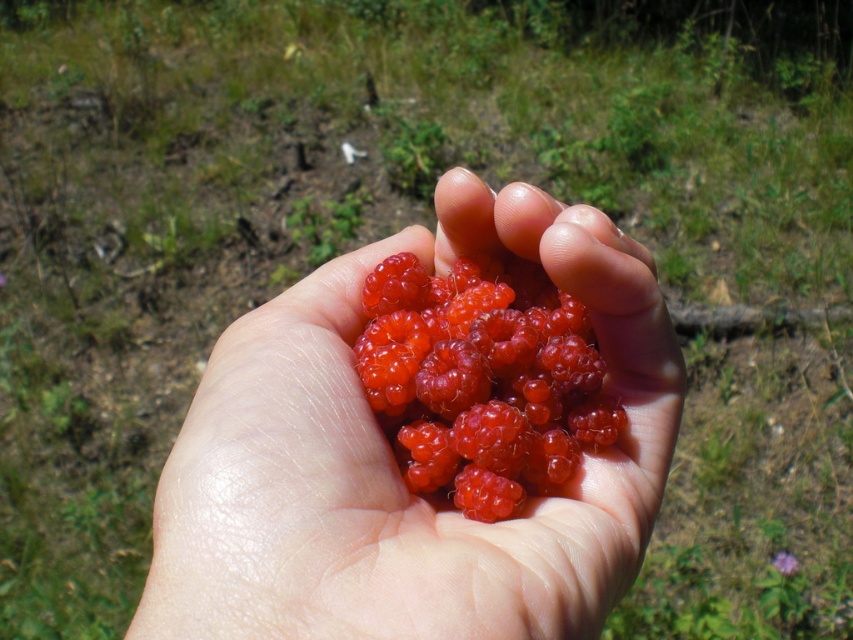
Question: Which object is farther from the camera taking this photo?

Choices:
 (A) glossy red raspberries at center
 (B) shiny red berries at center

Answer: (B)

Question: Can you confirm if glossy red raspberries at center is positioned below shiny red berries at center?

Choices:
 (A) yes
 (B) no

Answer: (A)

Question: Can you confirm if glossy red raspberries at center is thinner than shiny red berries at center?

Choices:
 (A) no
 (B) yes

Answer: (A)

Question: Which of the following is the closest to the observer?

Choices:
 (A) (468, 451)
 (B) (520, 236)

Answer: (A)

Question: Does glossy red raspberries at center have a smaller size compared to shiny red berries at center?

Choices:
 (A) no
 (B) yes

Answer: (A)